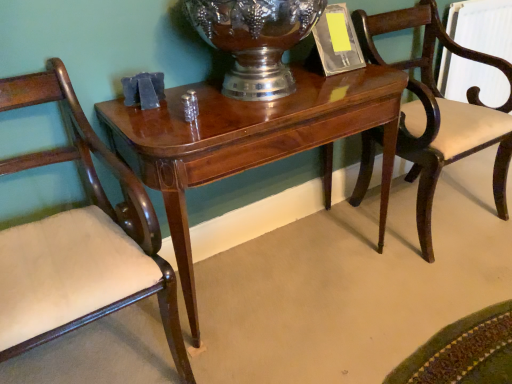
In order to click on free space underneath shiny wood table at center (from a real-world perspective) in this screenshot , I will do `click(272, 270)`.